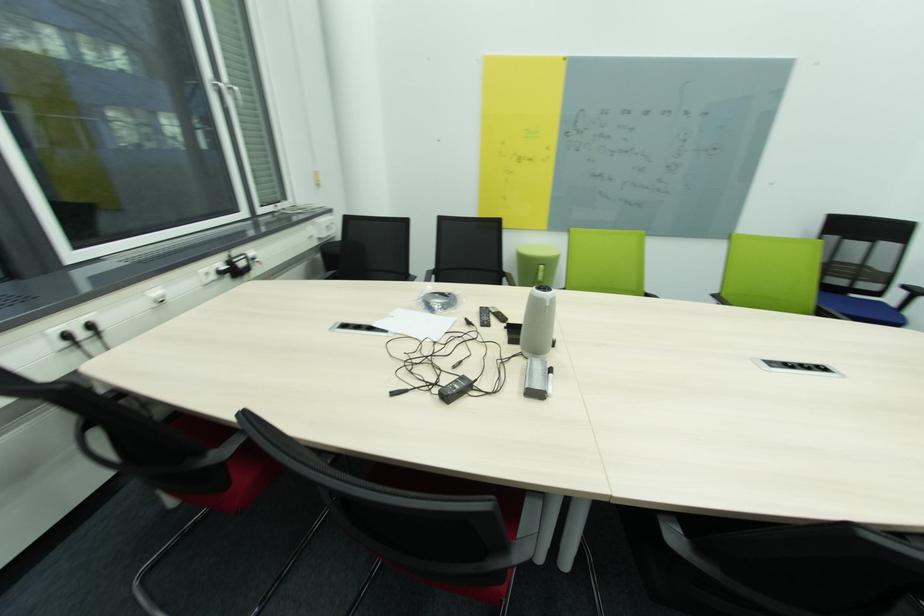
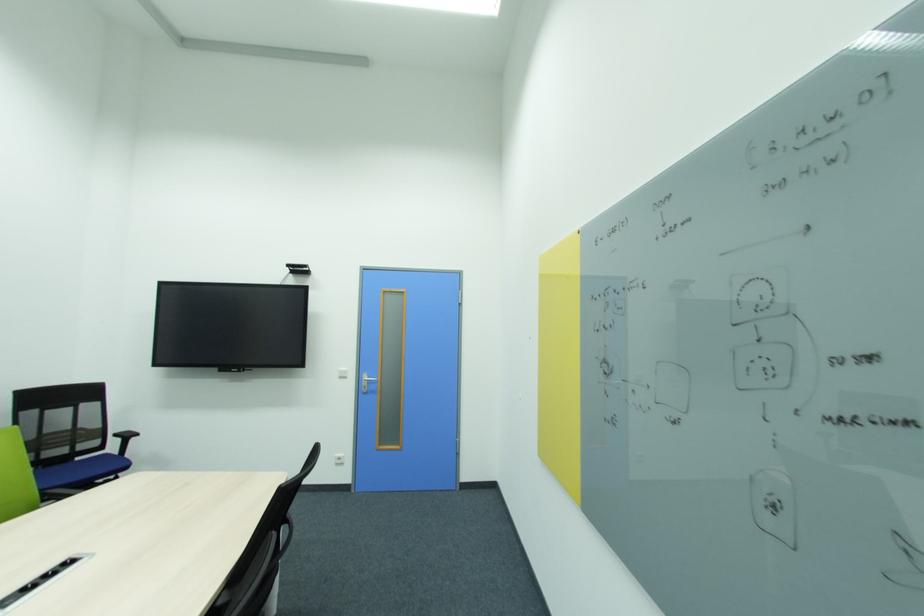
The point at (856,297) is marked in the first image. Where is the corresponding point in the second image?

(82, 460)